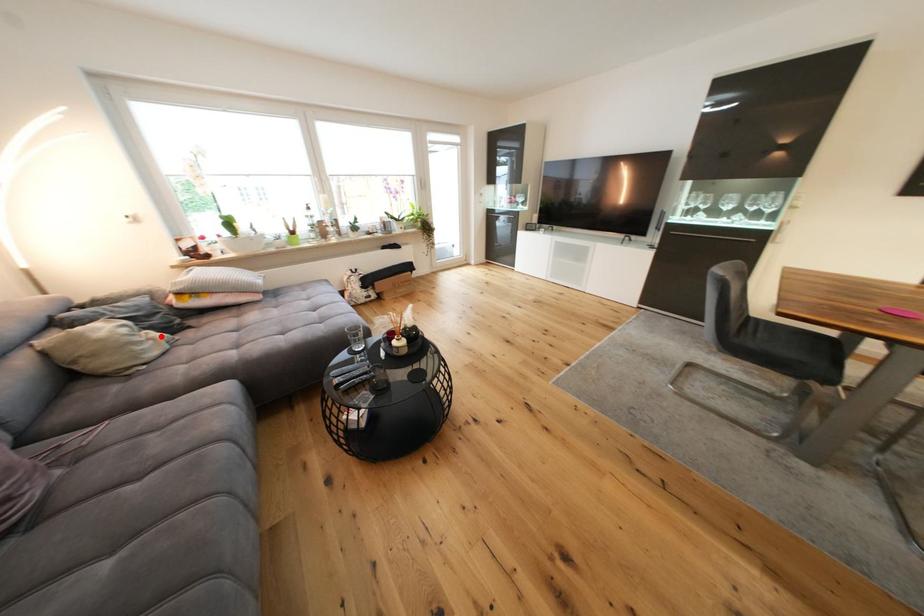
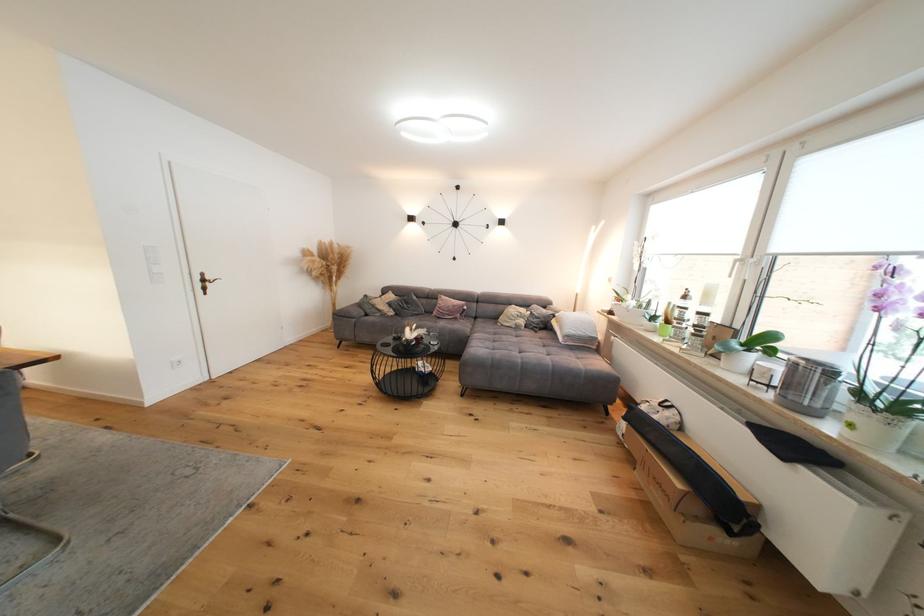
Find the pixel in the second image that matches the highlighted location in the first image.

(529, 323)